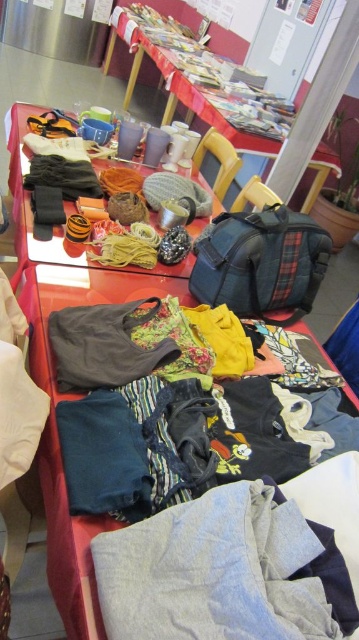
Question: Is knitted woolen scarf at center smaller than wooden chair at center?

Choices:
 (A) no
 (B) yes

Answer: (A)

Question: Which point is farther to the camera?

Choices:
 (A) wooden chair at center
 (B) knitted woolen scarf at center
 (C) gray cotton pants at lower center
 (D) fluffy fabric basket at center

Answer: (D)

Question: Which object appears farthest from the camera in this image?

Choices:
 (A) yellow fabric chair at center
 (B) wooden chair at center
 (C) knitted woolen scarf at center
 (D) fluffy fabric basket at center

Answer: (D)

Question: Can you confirm if gray cotton pants at lower center is positioned to the left of yellow fabric chair at center?

Choices:
 (A) yes
 (B) no

Answer: (A)

Question: Is knitted woolen scarf at center closer to camera compared to wooden chair at center?

Choices:
 (A) yes
 (B) no

Answer: (A)

Question: Which point appears closest to the camera in this image?

Choices:
 (A) (184, 67)
 (B) (10, 118)

Answer: (B)